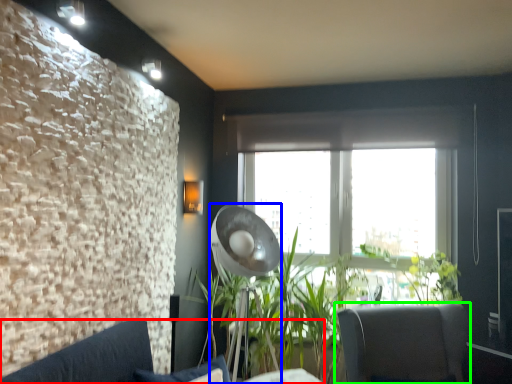
Question: Which object is positioned closest to studio couch (highlighted by a red box)? Select from lamp (highlighted by a blue box) and chair (highlighted by a green box).

Choices:
 (A) lamp
 (B) chair

Answer: (A)